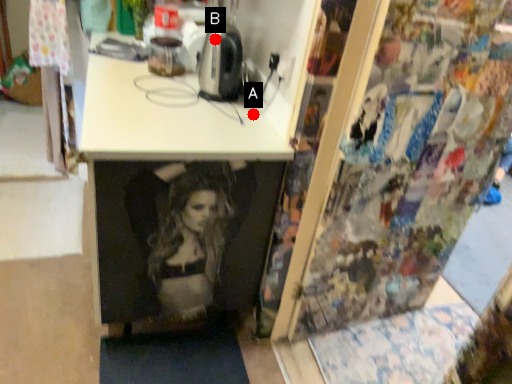
Question: Two points are circled on the image, labeled by A and B beside each circle. Which point is farther from the camera taking this photo?

Choices:
 (A) A is further
 (B) B is further

Answer: (A)